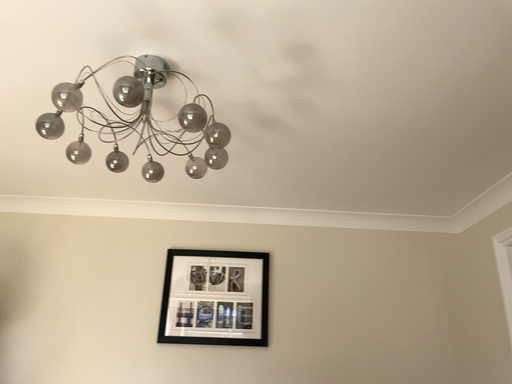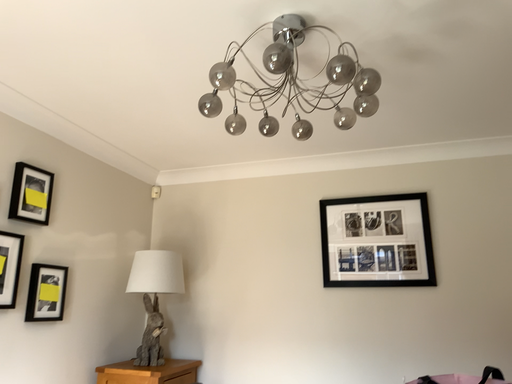
Question: How did the camera likely rotate when shooting the video?

Choices:
 (A) rotated left
 (B) rotated right

Answer: (A)